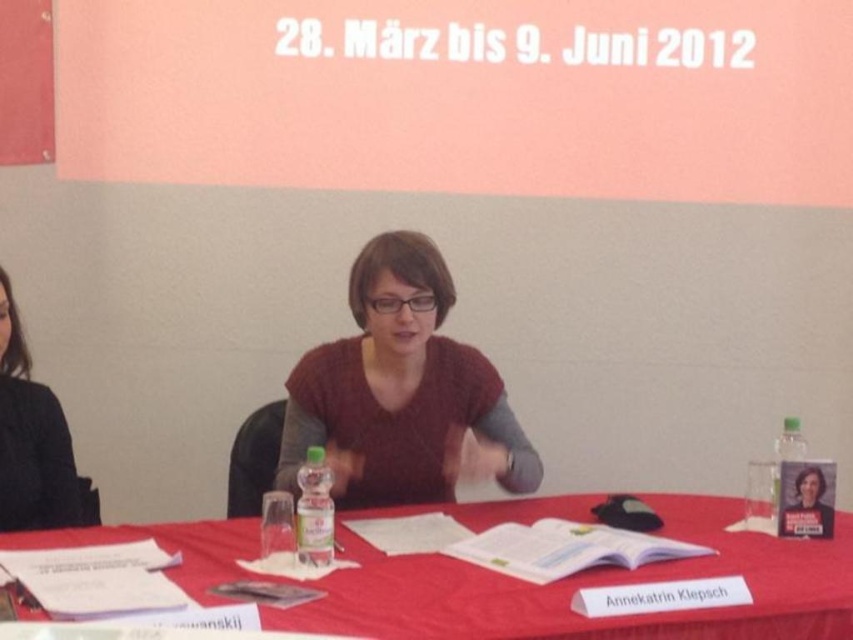
Question: Which object appears farthest from the camera in this image?

Choices:
 (A) clear plastic bottle at right
 (B) matte brown sweater at center

Answer: (B)

Question: Which object appears farthest from the camera in this image?

Choices:
 (A) clear plastic bottle at right
 (B) red cloth table at center
 (C) matte brown sweater at center
 (D) black fabric hair at left

Answer: (D)

Question: Among these points, which one is nearest to the camera?

Choices:
 (A) (331, 476)
 (B) (561, 593)
 (C) (347, 467)
 (D) (1, 440)

Answer: (B)

Question: Can you confirm if black fabric hair at left is positioned to the left of translucent plastic bottle at center?

Choices:
 (A) no
 (B) yes

Answer: (B)

Question: Can you confirm if red cloth table at center is positioned to the right of black fabric hair at left?

Choices:
 (A) yes
 (B) no

Answer: (A)

Question: Can you confirm if translucent plastic bottle at center is thinner than clear plastic bottle at right?

Choices:
 (A) yes
 (B) no

Answer: (B)